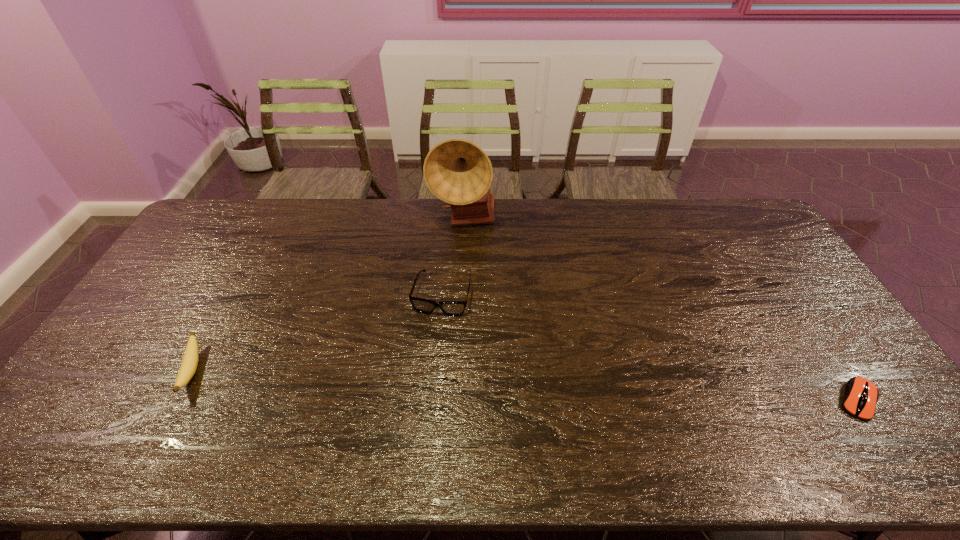
The image size is (960, 540). Identify the location of free space on the desktop that is between the leftmost object and the shortest object and is positioned on the front-facing side of the third nearest object. (420, 380).

This screenshot has height=540, width=960. Find the location of `vacant space on the desktop that is between the third tallest object and the computer mouse and is positioned on the horn of the tallest object`. vacant space on the desktop that is between the third tallest object and the computer mouse and is positioned on the horn of the tallest object is located at coordinates (592, 388).